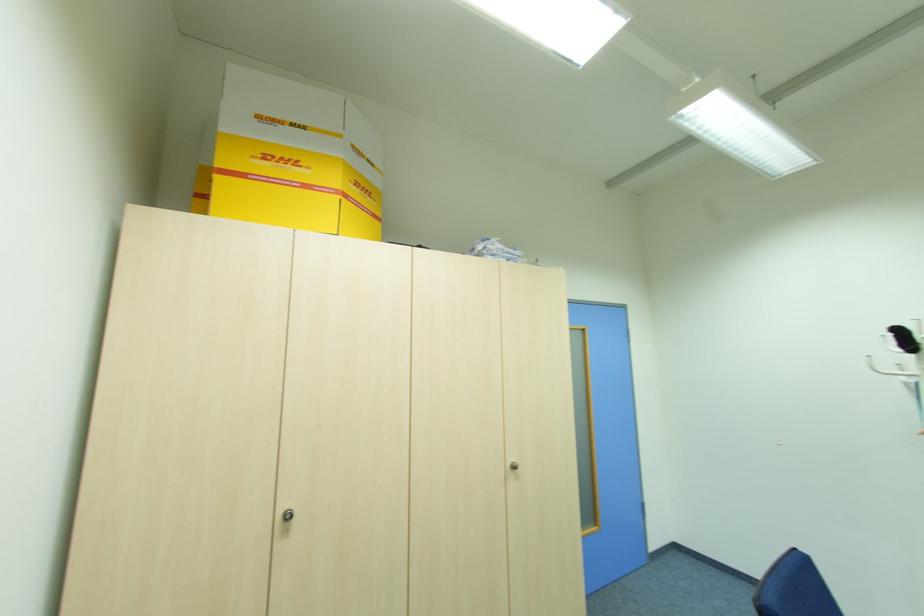
You are a GUI agent. You are given a task and a screenshot of the screen. Output one action in this format:
    pyautogui.click(x=<x>, y=<y>)
    Task: Click on the yellow DHL box
    
    Given the screenshot: What is the action you would take?
    pyautogui.click(x=294, y=158)